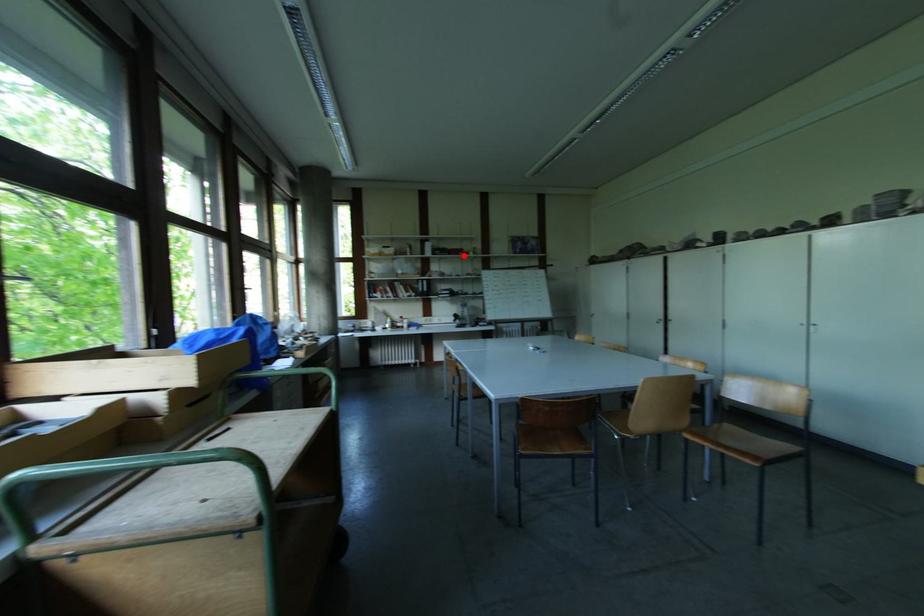
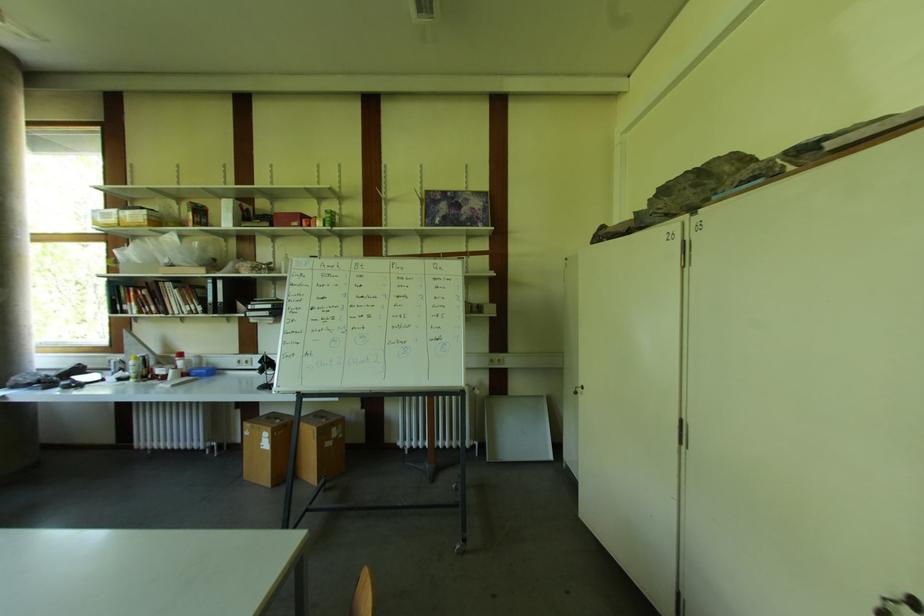
Locate, in the second image, the point that corresponds to the highlighted location in the first image.

(298, 225)